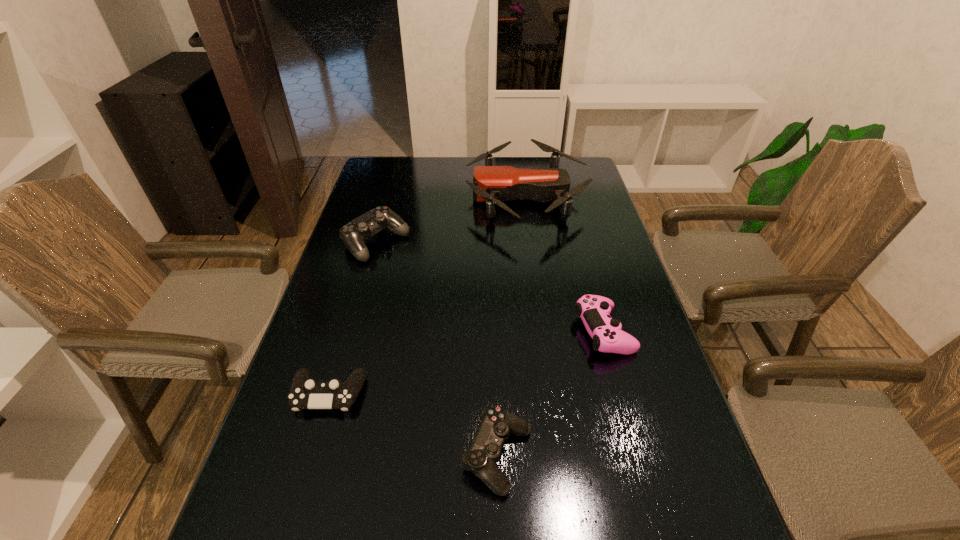
At what (x,y) coordinates should I click in order to perform the action: click on free spot between the second tallest object and the second farthest control. Please return your answer as a coordinate pair (x, y). This screenshot has width=960, height=540. Looking at the image, I should click on (490, 287).

Where is `free space between the rightmost control and the tallest object`? free space between the rightmost control and the tallest object is located at coordinates (564, 264).

The height and width of the screenshot is (540, 960). Find the location of `free space between the third farthest object and the shortest control`. free space between the third farthest object and the shortest control is located at coordinates (x=466, y=363).

Identify which object is the closest to the tallest object. Please provide its 2D coordinates. Your answer should be formatted as a tuple, i.e. [(x, y)], where the tuple contains the x and y coordinates of a point satisfying the conditions above.

[(353, 234)]

At what (x,y) coordinates should I click in order to perform the action: click on object that ranks as the closest to the tallest object. Please return your answer as a coordinate pair (x, y). Looking at the image, I should click on (353, 234).

Identify the location of control that is the second closest one to the drone. This screenshot has width=960, height=540. (594, 310).

Identify the location of control that is the third nearest to the shortest control. (594, 310).

At what (x,y) coordinates should I click in order to perform the action: click on vacant region that satisfies the following two spatial constraints: 1. on the front-facing side of the tallest object; 2. on the back side of the third farthest object. Please return your answer as a coordinate pair (x, y). The height and width of the screenshot is (540, 960). Looking at the image, I should click on (545, 332).

Image resolution: width=960 pixels, height=540 pixels. In order to click on free space that satisfies the following two spatial constraints: 1. on the front-facing side of the drone; 2. on the surface of the shortest control in this screenshot , I will do `click(554, 394)`.

Find the location of a particular element. vacant point that satisfies the following two spatial constraints: 1. on the front-facing side of the rightmost control; 2. on the left side of the tallest object is located at coordinates (545, 332).